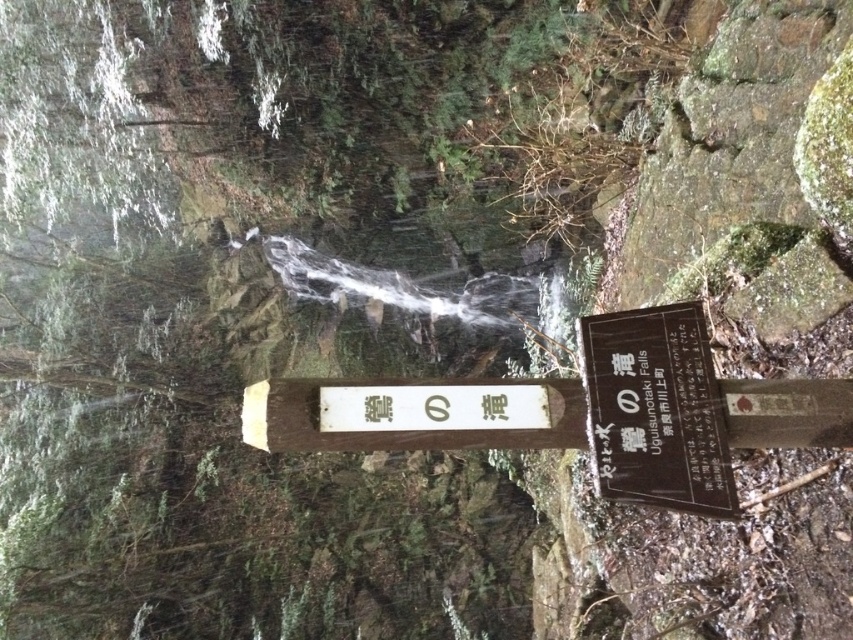
Does clear water at center have a greater height compared to black wood sign at center?

Correct, clear water at center is much taller as black wood sign at center.

Is point (364, 195) in front of point (643, 371)?

No, it is not.

This screenshot has width=853, height=640. I want to click on clear water at center, so click(244, 317).